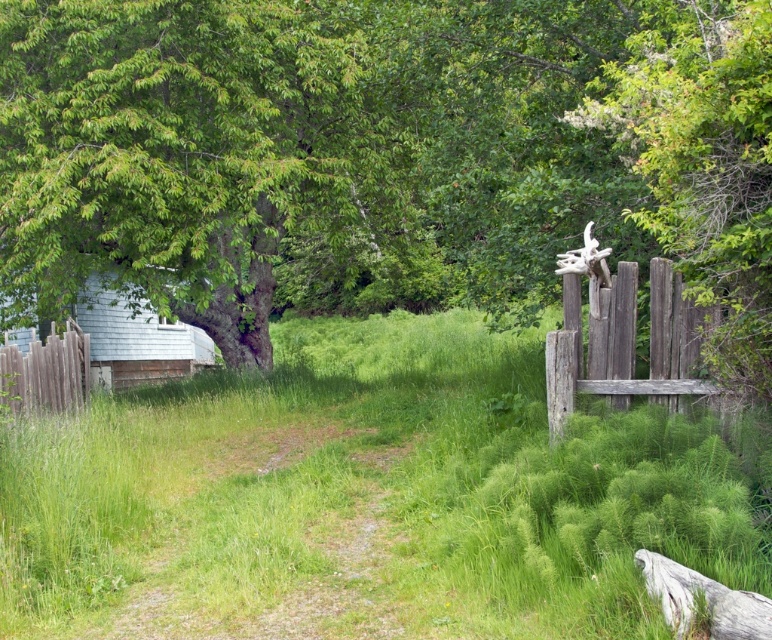
You are standing at the end of the dirt path and want to walk towards the wooden structure. Which direction should you go relative to the green leafy tree at upper left and the green grassy at center?

You should head towards the green grassy at center, which is to the right of the green leafy tree at upper left, as the dirt path leads towards the wooden structure in that direction.

You are a painter setting up your easel to capture the rural scene. You have two objects in view, the brown wooden fence at left and the gray rough log at lower right. Which object should you focus on if you want to paint a wider subject?

The brown wooden fence at left is wider than the gray rough log at lower right, so you should focus on the brown wooden fence at left for a wider subject.

Consider the image. You are planning to plant a new flower bed between the green leafy tree at upper left and the green grassy at center. The flower bed requires a minimum of 10 feet of space. Based on the scene, can you determine if there is enough space between them?

The green leafy tree at upper left is 8.89 feet from the green grassy at center, which is less than the required 10 feet for the flower bed. Therefore, there isn not enough space.